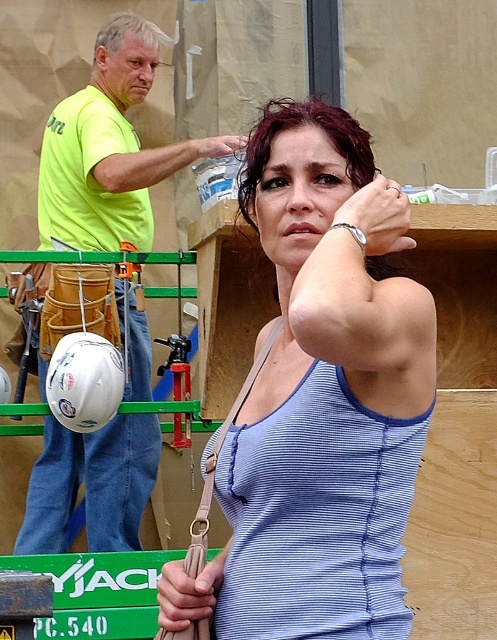
Is blue striped tank top at center bigger than neon yellow t-shirt at left?

Actually, blue striped tank top at center might be smaller than neon yellow t-shirt at left.

Where is `blue striped tank top at center`? This screenshot has width=497, height=640. blue striped tank top at center is located at coordinates click(320, 401).

Does point (314, 346) lie in front of point (115, 132)?

Yes, it is.

Find the location of a particular element. Image resolution: width=497 pixels, height=640 pixels. blue striped tank top at center is located at coordinates 320,401.